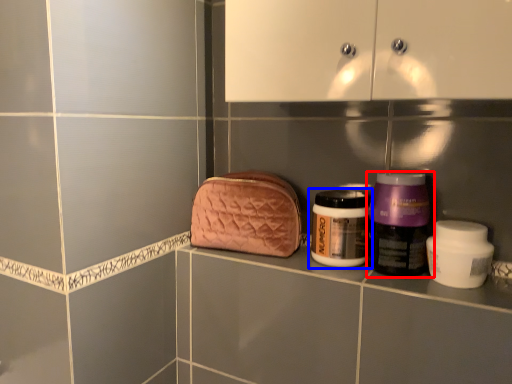
Question: Which point is closer to the camera, bottle (highlighted by a red box) or bottle (highlighted by a blue box)?

Choices:
 (A) bottle
 (B) bottle

Answer: (A)